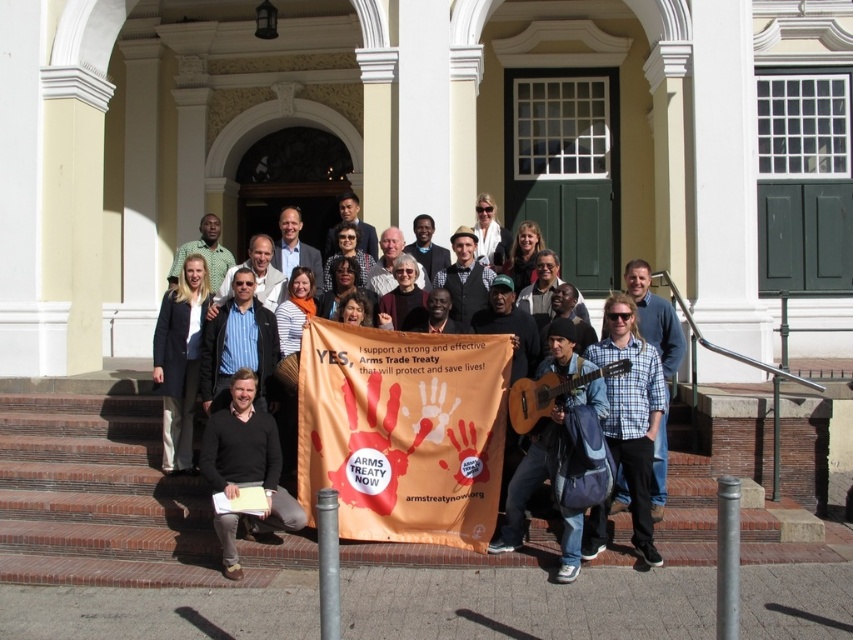
You are organizing a photo shoot and need to ensure that the matte white shirt at center and the matte black shirt at center are positioned exactly 2 meters apart for a group photo. Given the current setup, can you confirm if their current distance meets this requirement?

The distance between the matte white shirt at center and the matte black shirt at center is exactly 2.00 meters, so their current positioning meets the requirement for the photo shoot.

You are a photographer trying to capture a clear shot of the matte black guitar at center and the matte black shirt at center. Which object should you focus on first to ensure it appears sharp in the foreground?

The matte black guitar at center is in front of the matte black shirt at center, so you should focus on the matte black guitar at center first to ensure it appears sharp in the foreground.